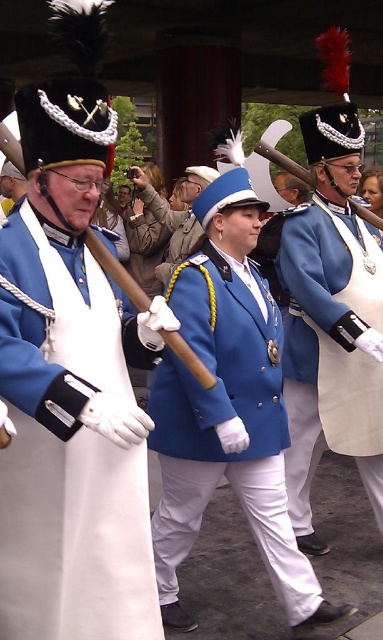
Question: Is white matte uniform at left below matte blue jacket at center?

Choices:
 (A) yes
 (B) no

Answer: (B)

Question: Is white matte uniform at left smaller than matte blue coat at center?

Choices:
 (A) yes
 (B) no

Answer: (A)

Question: Which point appears farthest from the camera in this image?

Choices:
 (A) (292, 552)
 (B) (96, 310)
 (C) (324, 321)

Answer: (C)

Question: Estimate the real-world distances between objects in this image. Which object is closer to the matte blue coat at center?

Choices:
 (A) matte blue jacket at center
 (B) white matte uniform at left

Answer: (A)

Question: Can you confirm if white matte uniform at left is positioned above matte blue coat at center?

Choices:
 (A) yes
 (B) no

Answer: (B)

Question: Considering the real-world distances, which object is closest to the white matte uniform at left?

Choices:
 (A) matte blue coat at center
 (B) matte blue jacket at center

Answer: (B)